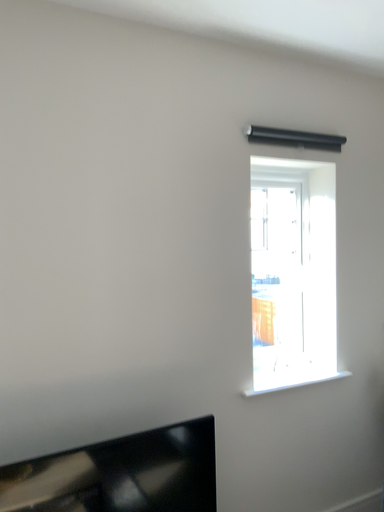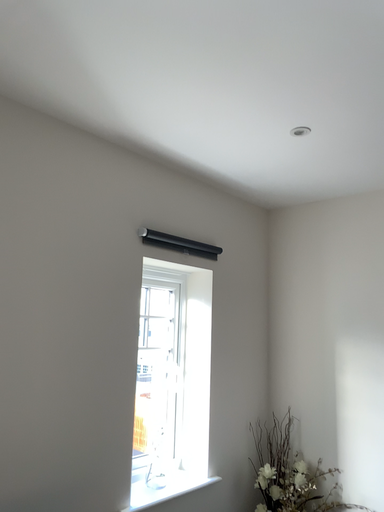
Question: Which way did the camera rotate in the video?

Choices:
 (A) rotated upward
 (B) rotated downward

Answer: (A)